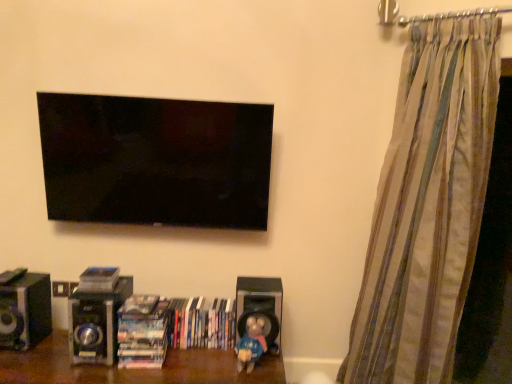
Locate an element on the screen. Image resolution: width=512 pixels, height=384 pixels. vacant area that lies between hardcover books at center, acting as the 2th book starting from the left, and hardcover books at center, the 3th book positioned from the left is located at coordinates (190, 352).